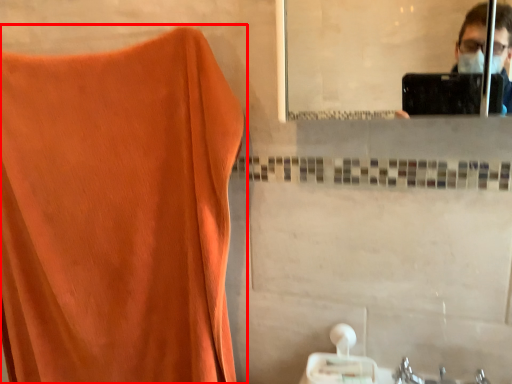
Question: Observing the image, what is the correct spatial positioning of curtain (annotated by the red box) in reference to tissue?

Choices:
 (A) left
 (B) right

Answer: (A)